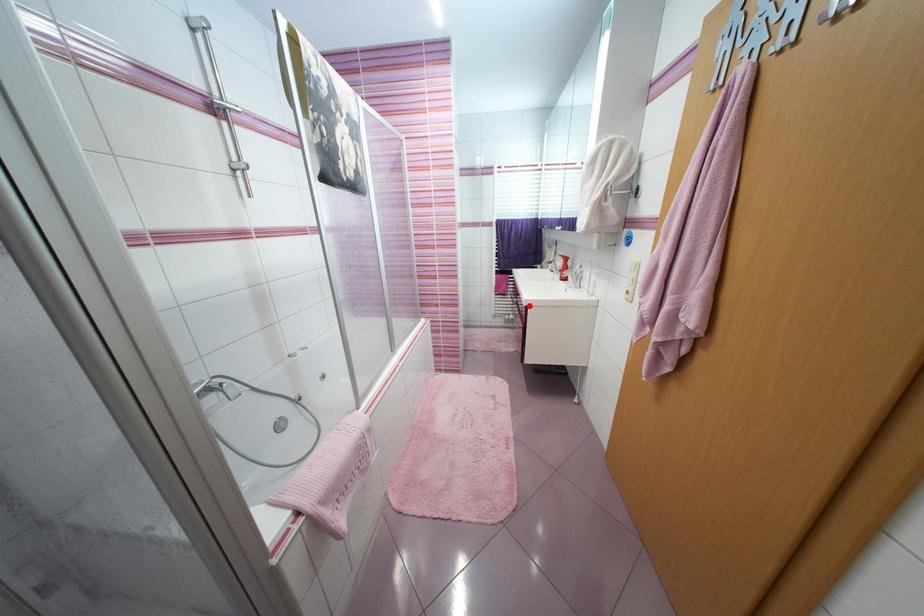
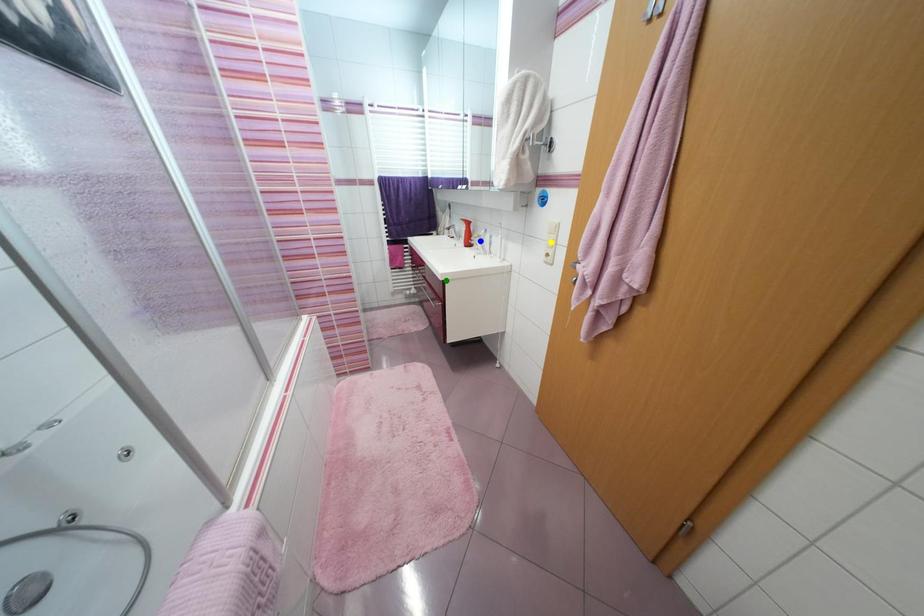
Question: I am providing you with two images of the same scene from different viewpoints. A red point is marked on the first image. You are given multiple points on the second image. Which spot in image 2 lines up with the point in image 1?

Choices:
 (A) blue point
 (B) yellow point
 (C) green point

Answer: (C)